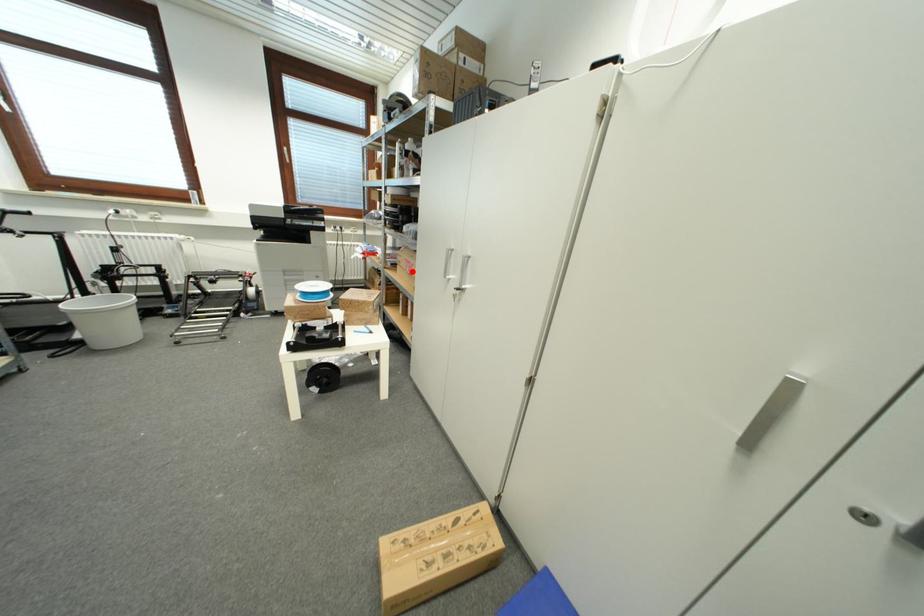
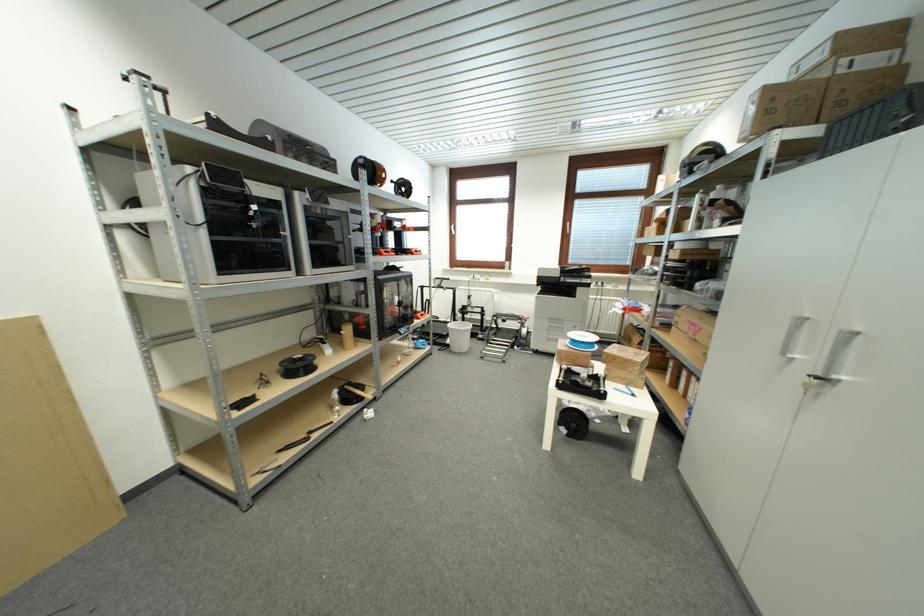
Where in the second image is the point corresponding to the highlighted location from the first image?

(696, 334)